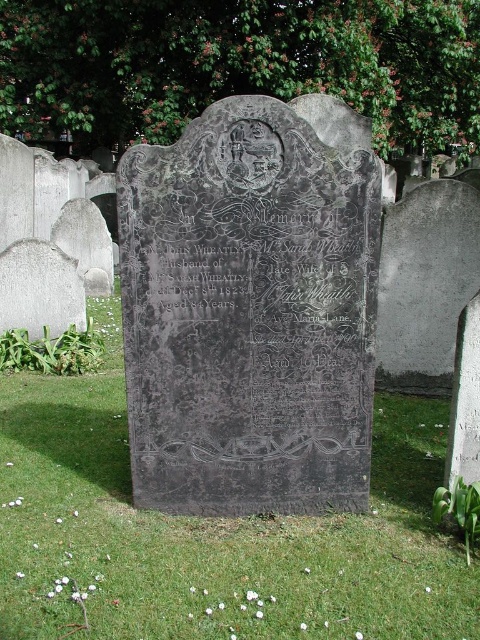
Who is positioned more to the left, black stone gravestone at center or green grass at center?

green grass at center is more to the left.

Is black stone gravestone at center bigger than green grass at center?

No.

What are the coordinates of `black stone gravestone at center` in the screenshot? It's located at (251, 308).

You are a GUI agent. You are given a task and a screenshot of the screen. Output one action in this format:
    pyautogui.click(x=<x>, y=<y>)
    Task: Click on the black stone gravestone at center
    
    Given the screenshot: What is the action you would take?
    pyautogui.click(x=251, y=308)